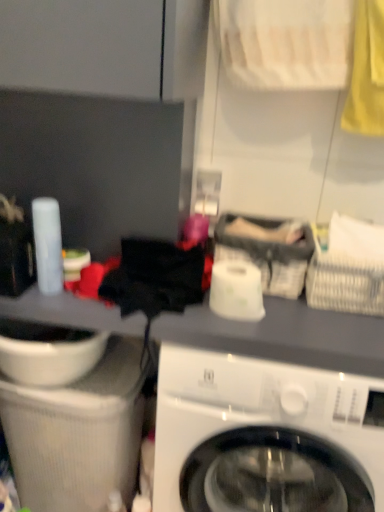
This screenshot has width=384, height=512. Identify the location of free spot in front of white glossy toilet paper at center. (241, 328).